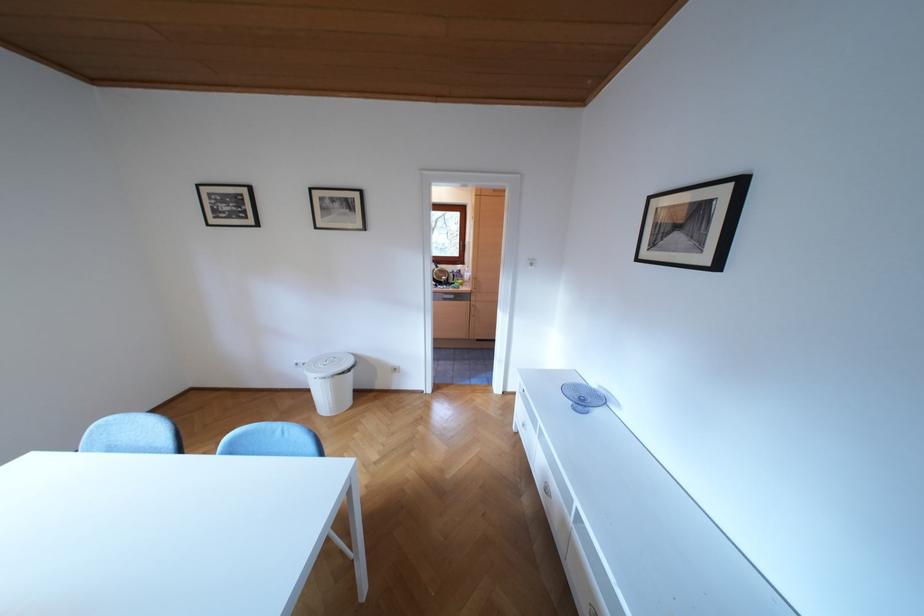
Where would you lift the white trash can lid? Please return your answer as a coordinate pair (x, y).

(330, 360)